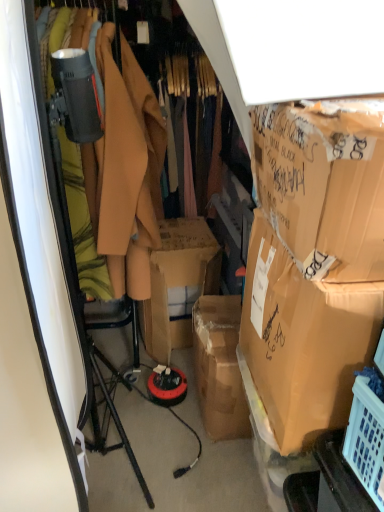
Question: Does brown cardboard box at right, acting as the second box starting from the bottom, touch matte brown coat at center?

Choices:
 (A) no
 (B) yes

Answer: (A)

Question: Is brown cardboard box at right, placed as the first box when sorted from top to bottom, at the right side of matte brown coat at center?

Choices:
 (A) yes
 (B) no

Answer: (A)

Question: From a real-world perspective, is brown cardboard box at right, placed as the first box when sorted from top to bottom, under matte brown coat at center?

Choices:
 (A) no
 (B) yes

Answer: (A)

Question: From the image's perspective, is brown cardboard box at right, acting as the second box starting from the bottom, located above matte brown coat at center?

Choices:
 (A) no
 (B) yes

Answer: (A)

Question: Can you confirm if brown cardboard box at right, acting as the second box starting from the bottom, is bigger than matte brown coat at center?

Choices:
 (A) yes
 (B) no

Answer: (B)

Question: Based on their sizes in the image, would you say matte brown coat at center is bigger or smaller than brown cardboard box at right, acting as the second box starting from the bottom?

Choices:
 (A) small
 (B) big

Answer: (B)

Question: Do you think matte brown coat at center is within brown cardboard box at right, acting as the second box starting from the bottom, or outside of it?

Choices:
 (A) inside
 (B) outside

Answer: (B)

Question: Is point (114, 274) positioned closer to the camera than point (336, 244)?

Choices:
 (A) closer
 (B) farther

Answer: (B)

Question: From a real-world perspective, relative to brown cardboard box at right, acting as the second box starting from the bottom, is matte brown coat at center vertically above or below?

Choices:
 (A) above
 (B) below

Answer: (B)

Question: Is point (271, 331) positioned closer to the camera than point (299, 264)?

Choices:
 (A) closer
 (B) farther

Answer: (B)

Question: Is brown cardboard box at right, the first box positioned from the bottom, to the left or to the right of brown cardboard box at right, placed as the first box when sorted from top to bottom, in the image?

Choices:
 (A) left
 (B) right

Answer: (B)

Question: Do you think brown cardboard box at right, the first box positioned from the bottom, is within brown cardboard box at right, placed as the first box when sorted from top to bottom, or outside of it?

Choices:
 (A) inside
 (B) outside

Answer: (B)

Question: From a real-world perspective, is brown cardboard box at right, which is counted as the second box, starting from the top, above or below brown cardboard box at right, acting as the second box starting from the bottom?

Choices:
 (A) below
 (B) above

Answer: (A)

Question: From their relative heights in the image, would you say brown cardboard box at right, the first box positioned from the bottom, is taller or shorter than matte brown coat at center?

Choices:
 (A) short
 (B) tall

Answer: (A)

Question: Do you think brown cardboard box at right, which is counted as the second box, starting from the top, is within matte brown coat at center, or outside of it?

Choices:
 (A) inside
 (B) outside

Answer: (B)